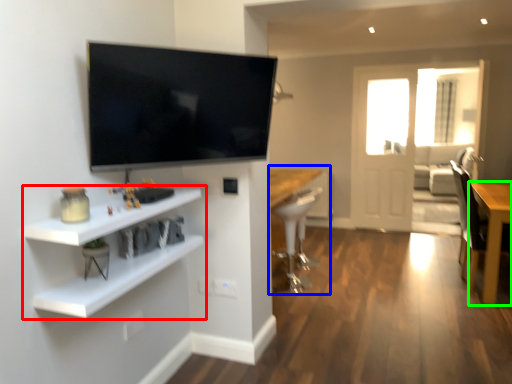
Question: Based on their relative distances, which object is farther from shelf (highlighted by a red box)? Choose from computer desk (highlighted by a blue box) and table (highlighted by a green box).

Choices:
 (A) computer desk
 (B) table

Answer: (B)